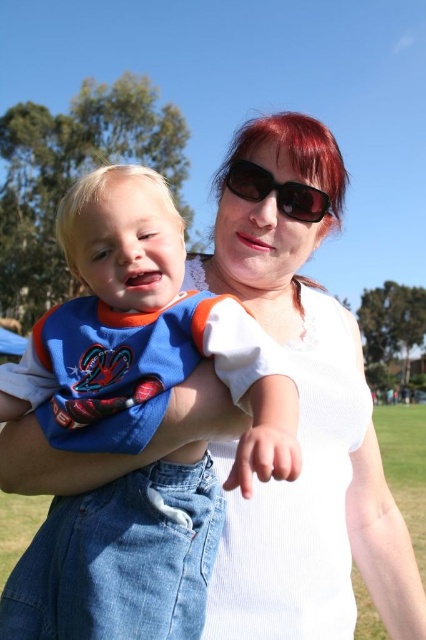
Question: From the image, what is the correct spatial relationship of matte blue jersey at center in relation to sunglasses at center?

Choices:
 (A) right
 (B) left

Answer: (B)

Question: In this image, where is matte blue jersey at center located relative to sunglasses at center?

Choices:
 (A) right
 (B) left

Answer: (B)

Question: Which object is closer to the camera taking this photo?

Choices:
 (A) sunglasses at center
 (B) matte blue jersey at center

Answer: (B)

Question: Among these points, which one is farthest from the camera?

Choices:
 (A) (241, 161)
 (B) (170, 292)

Answer: (A)

Question: Can you confirm if matte blue jersey at center is smaller than sunglasses at center?

Choices:
 (A) no
 (B) yes

Answer: (A)

Question: Which object is closer to the camera taking this photo?

Choices:
 (A) matte blue jersey at center
 (B) sunglasses at center

Answer: (A)